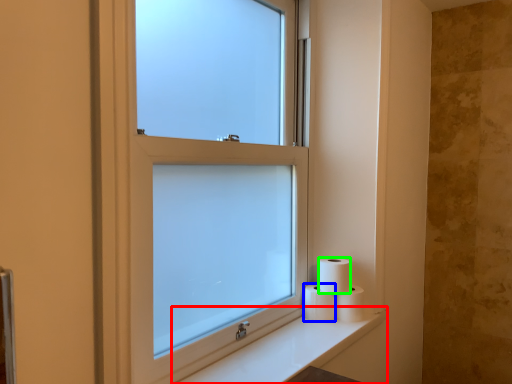
Question: Which object is the closest to the counter top (highlighted by a red box)? Choose among these: toilet paper (highlighted by a blue box) or toilet paper (highlighted by a green box).

Choices:
 (A) toilet paper
 (B) toilet paper

Answer: (A)